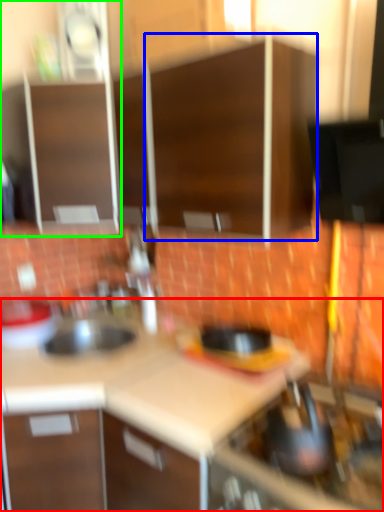
Question: Considering the real-world distances, which object is closest to countertop (highlighted by a red box)? cabinetry (highlighted by a blue box) or cabinetry (highlighted by a green box).

Choices:
 (A) cabinetry
 (B) cabinetry

Answer: (A)